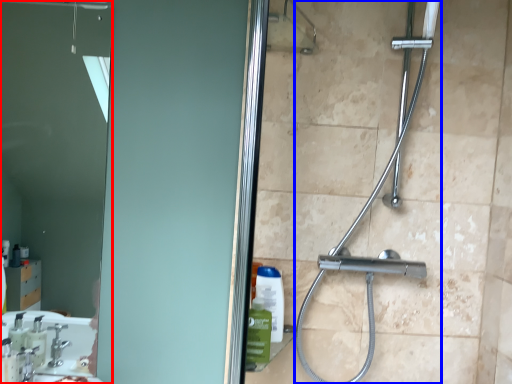
Question: Which object appears closest to the camera in this image, mirror (highlighted by a red box) or shower (highlighted by a blue box)?

Choices:
 (A) mirror
 (B) shower

Answer: (B)